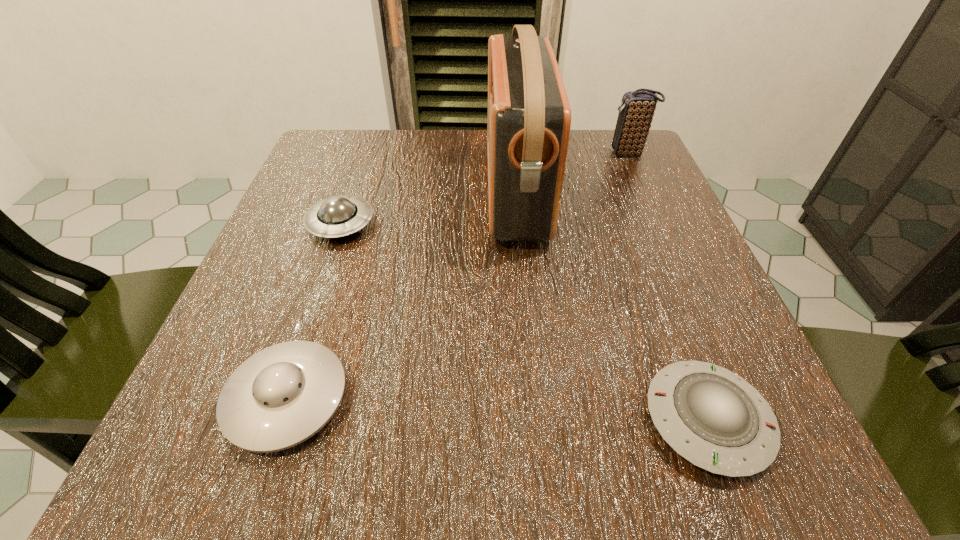
Where is `object at the near right corner`? This screenshot has height=540, width=960. object at the near right corner is located at coordinates (713, 418).

Locate an element on the screen. vacant space at the far edge of the desktop is located at coordinates (480, 164).

Identify the location of vacant space at the near edge of the desktop. This screenshot has height=540, width=960. (500, 413).

Locate an element on the screen. vacant space at the left edge of the desktop is located at coordinates coord(276,295).

In the image, there is a desktop. At what (x,y) coordinates should I click in order to perform the action: click on vacant space at the right edge. Please return your answer as a coordinate pair (x, y). This screenshot has width=960, height=540. Looking at the image, I should click on (692, 279).

In order to click on vacant space at the far left corner in this screenshot , I will do `click(323, 171)`.

Identify the location of vacant area at the near left corner. (202, 418).

At what (x,y) coordinates should I click in order to perform the action: click on unoccupied position between the radio receiver and the rightmost saucer. Please return your answer as a coordinate pair (x, y). The image size is (960, 540). Looking at the image, I should click on (612, 307).

This screenshot has height=540, width=960. What are the coordinates of `empty space between the third object from right to left and the farthest saucer` in the screenshot? It's located at (428, 209).

The width and height of the screenshot is (960, 540). Identify the location of vacant space in between the third object from left to right and the shortest saucer. (612, 307).